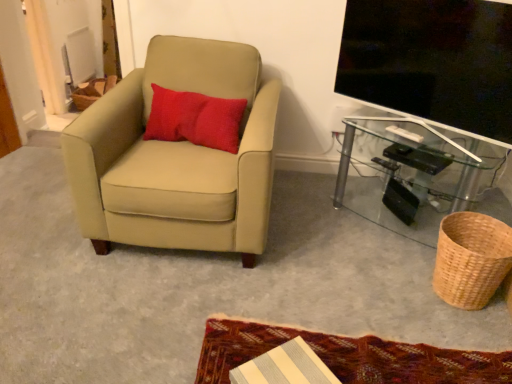
The width and height of the screenshot is (512, 384). I want to click on empty space that is in between suede beige armchair at left and textured woolen mat at lower center, so click(279, 272).